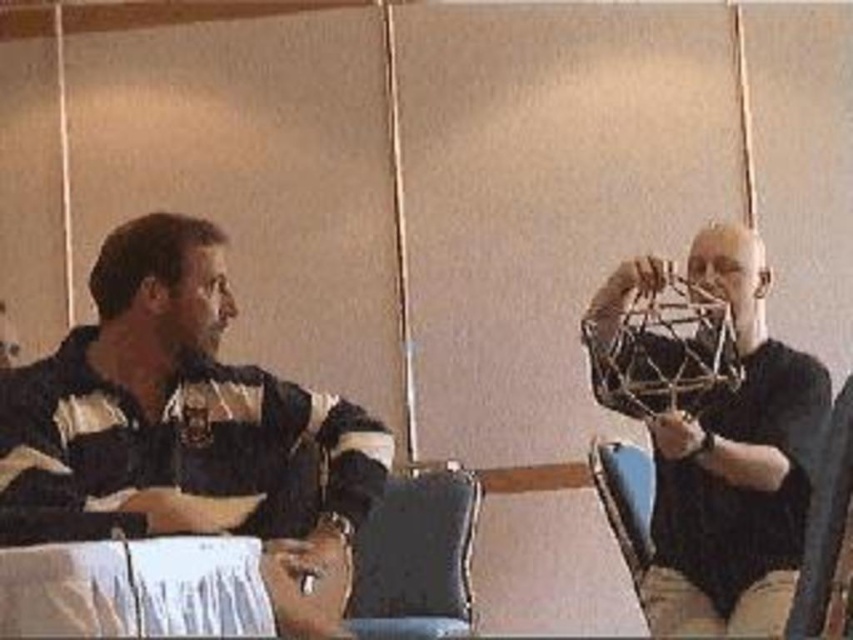
You are a photographer positioned behind the striped jersey shirt at left and want to take a photo of the metallic gold geometric structure at right without the shirt blocking the view. Can you adjust your position to do so?

The striped jersey shirt at left is closer to the viewer than the metallic gold geometric structure at right. By moving your position further back or to the side, you can position yourself so that the shirt no longer blocks the view of the metallic gold geometric structure at right.

You are a photographer setting up for a portrait session in this conference room. You need to ensure that the metallic gold geometric structure at right and the dark gray fabric chair at lower center are both visible in the frame. Given their height difference, which object will appear larger in the photo?

The metallic gold geometric structure at right appears larger in the photo because it has a greater height compared to the dark gray fabric chair at lower center.